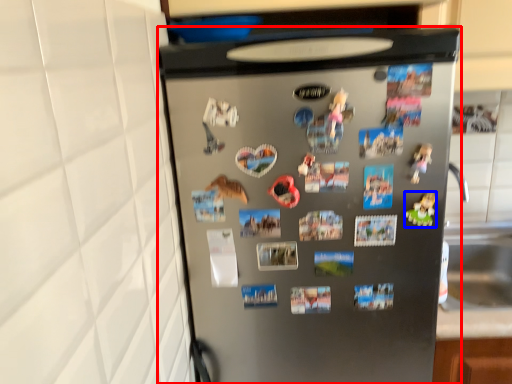
Question: Among these objects, which one is nearest to the camera, refrigerator (highlighted by a red box) or toy (highlighted by a blue box)?

Choices:
 (A) refrigerator
 (B) toy

Answer: (A)